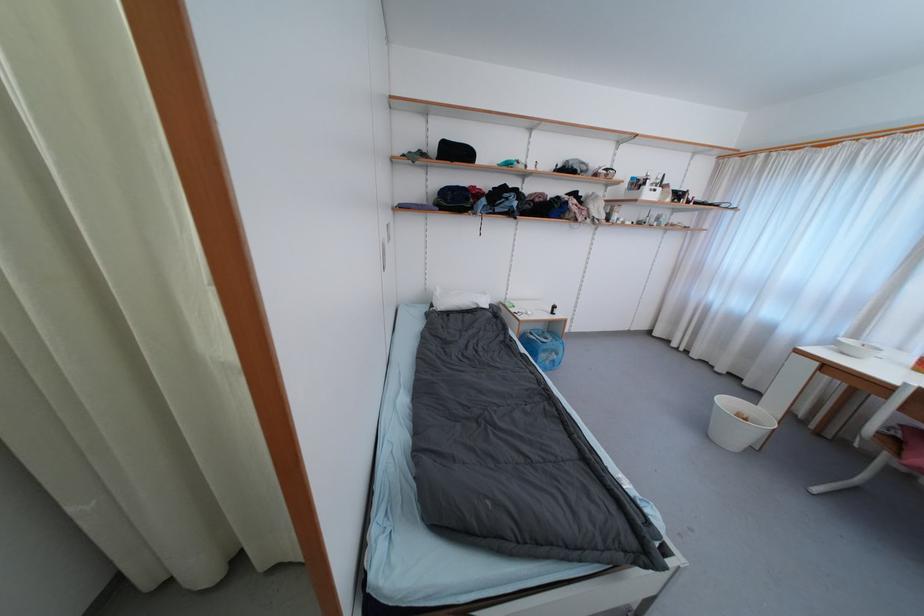
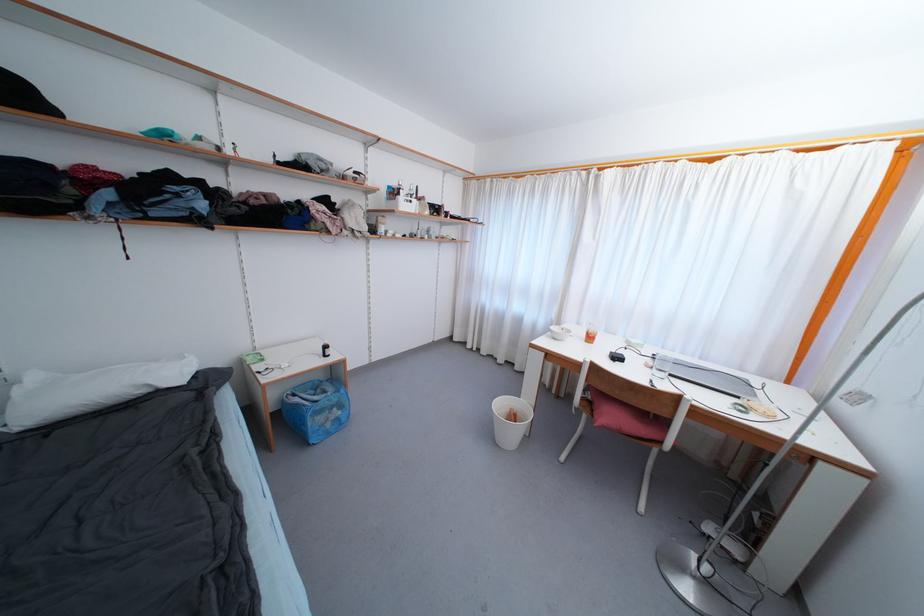
Where in the second image is the point corresponding to (732,405) from the first image?

(505, 407)